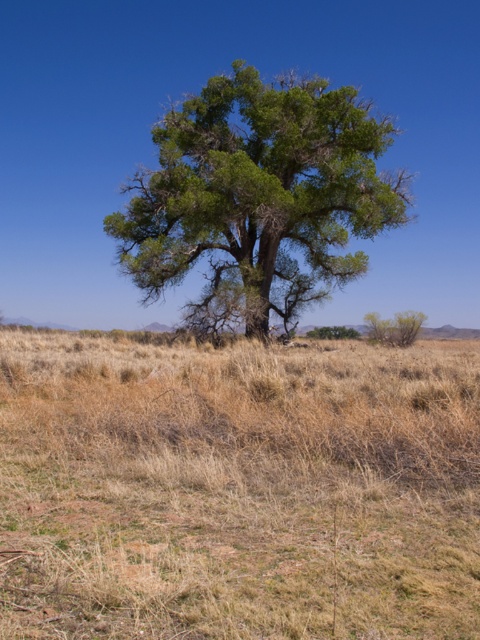
Question: Which of the following is the closest to the observer?

Choices:
 (A) dry grass at center
 (B) green leafy tree at center

Answer: (A)

Question: Which point is closer to the camera?

Choices:
 (A) dry grass at center
 (B) green leafy tree at center

Answer: (A)

Question: Does dry grass at center have a greater width compared to green leafy tree at center?

Choices:
 (A) yes
 (B) no

Answer: (B)

Question: Is dry grass at center to the right of green leafy tree at center from the viewer's perspective?

Choices:
 (A) no
 (B) yes

Answer: (B)

Question: Is dry grass at center bigger than green leafy tree at center?

Choices:
 (A) yes
 (B) no

Answer: (B)